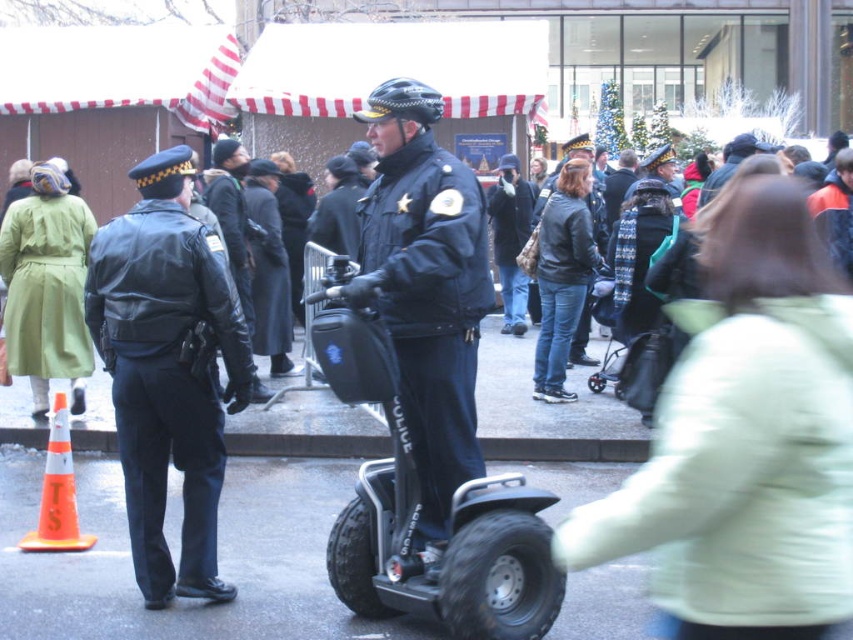
Can you confirm if black leather jacket at left is bigger than dark blue leather jacket at center?

Actually, black leather jacket at left might be smaller than dark blue leather jacket at center.

Is point (167, 332) closer to viewer compared to point (450, 163)?

No, (167, 332) is further to viewer.

This screenshot has height=640, width=853. I want to click on black leather jacket at left, so click(x=167, y=371).

Between dark blue leather jacket at center and orange reflective traffic cone at lower left, which one is positioned lower?

orange reflective traffic cone at lower left is below.

Looking at this image, does dark blue leather jacket at center appear on the left side of orange reflective traffic cone at lower left?

No, dark blue leather jacket at center is not to the left of orange reflective traffic cone at lower left.

Measure the distance between dark blue leather jacket at center and camera.

A distance of 3.85 meters exists between dark blue leather jacket at center and camera.

Where is `dark blue leather jacket at center`? The image size is (853, 640). dark blue leather jacket at center is located at coordinates (425, 289).

The width and height of the screenshot is (853, 640). What do you see at coordinates (167, 371) in the screenshot?
I see `black leather jacket at left` at bounding box center [167, 371].

Who is taller, black leather jacket at left or orange reflective traffic cone at lower left?

black leather jacket at left is taller.

This screenshot has width=853, height=640. What do you see at coordinates (167, 371) in the screenshot?
I see `black leather jacket at left` at bounding box center [167, 371].

The width and height of the screenshot is (853, 640). What are the coordinates of `black leather jacket at left` in the screenshot? It's located at (167, 371).